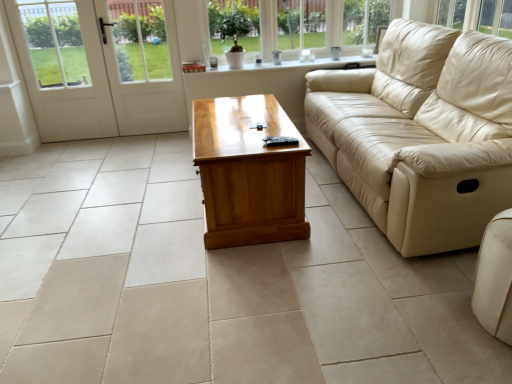
Question: From the image's perspective, is white glossy door at left above beige leather couch at lower right, the 1th studio couch in the bottom-to-top sequence?

Choices:
 (A) yes
 (B) no

Answer: (A)

Question: Is white glossy door at left facing away from beige leather couch at lower right, marked as the 2th studio couch in a top-to-bottom arrangement?

Choices:
 (A) yes
 (B) no

Answer: (B)

Question: Could you tell me if white glossy door at left is facing beige leather couch at lower right, the 1th studio couch in the bottom-to-top sequence?

Choices:
 (A) yes
 (B) no

Answer: (B)

Question: Does white glossy door at left have a smaller size compared to beige leather couch at lower right, the 1th studio couch in the bottom-to-top sequence?

Choices:
 (A) yes
 (B) no

Answer: (B)

Question: Can you confirm if white glossy door at left is bigger than beige leather couch at lower right, the 1th studio couch in the bottom-to-top sequence?

Choices:
 (A) yes
 (B) no

Answer: (A)

Question: Can you confirm if white glossy door at left is shorter than beige leather couch at lower right, which appears as the first studio couch when viewed from the front?

Choices:
 (A) no
 (B) yes

Answer: (A)

Question: Is beige leather couch at lower right, marked as the 2th studio couch in a top-to-bottom arrangement, in contact with white glossy door at left?

Choices:
 (A) yes
 (B) no

Answer: (B)

Question: Does beige leather couch at lower right, the 2th studio couch viewed from the back, have a greater width compared to white glossy door at left?

Choices:
 (A) no
 (B) yes

Answer: (B)

Question: Are beige leather couch at lower right, the 2th studio couch viewed from the back, and white glossy door at left far apart?

Choices:
 (A) no
 (B) yes

Answer: (B)

Question: From a real-world perspective, is beige leather couch at lower right, marked as the 2th studio couch in a top-to-bottom arrangement, located higher than white glossy door at left?

Choices:
 (A) no
 (B) yes

Answer: (A)

Question: From a real-world perspective, does beige leather couch at lower right, the 2th studio couch viewed from the back, sit lower than white glossy door at left?

Choices:
 (A) yes
 (B) no

Answer: (A)

Question: Does beige leather couch at lower right, the 1th studio couch in the bottom-to-top sequence, have a greater height compared to white glossy door at left?

Choices:
 (A) no
 (B) yes

Answer: (A)

Question: Can you confirm if clear glass window at upper center is shorter than beige leather couch at right, the 1th studio couch positioned from the top?

Choices:
 (A) no
 (B) yes

Answer: (B)